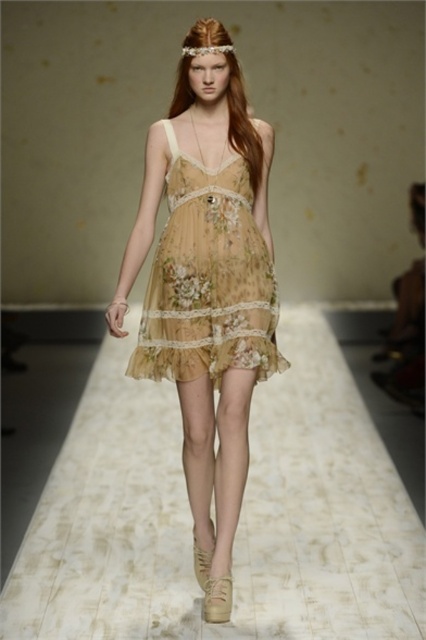
Question: Can you confirm if translucent floral dress at center is bigger than floral chiffon dress at center?

Choices:
 (A) no
 (B) yes

Answer: (B)

Question: Can you confirm if translucent floral dress at center is bigger than floral chiffon dress at center?

Choices:
 (A) yes
 (B) no

Answer: (A)

Question: Which point appears farthest from the camera in this image?

Choices:
 (A) (218, 269)
 (B) (180, 112)

Answer: (B)

Question: Which point appears farthest from the camera in this image?

Choices:
 (A) (164, 376)
 (B) (227, 508)

Answer: (A)

Question: Can you confirm if translucent floral dress at center is positioned below floral chiffon dress at center?

Choices:
 (A) yes
 (B) no

Answer: (A)

Question: Which object is closer to the camera taking this photo?

Choices:
 (A) floral chiffon dress at center
 (B) translucent floral dress at center

Answer: (B)